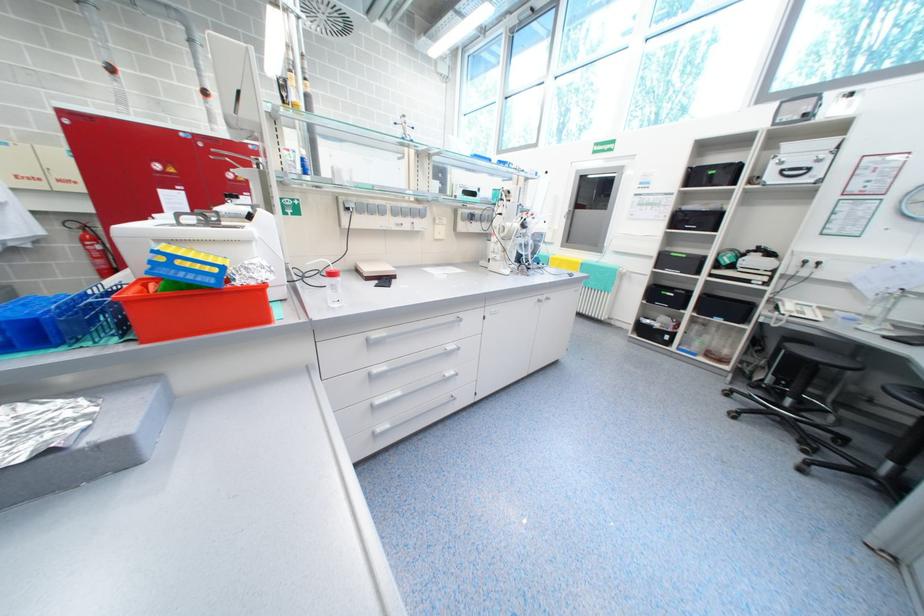
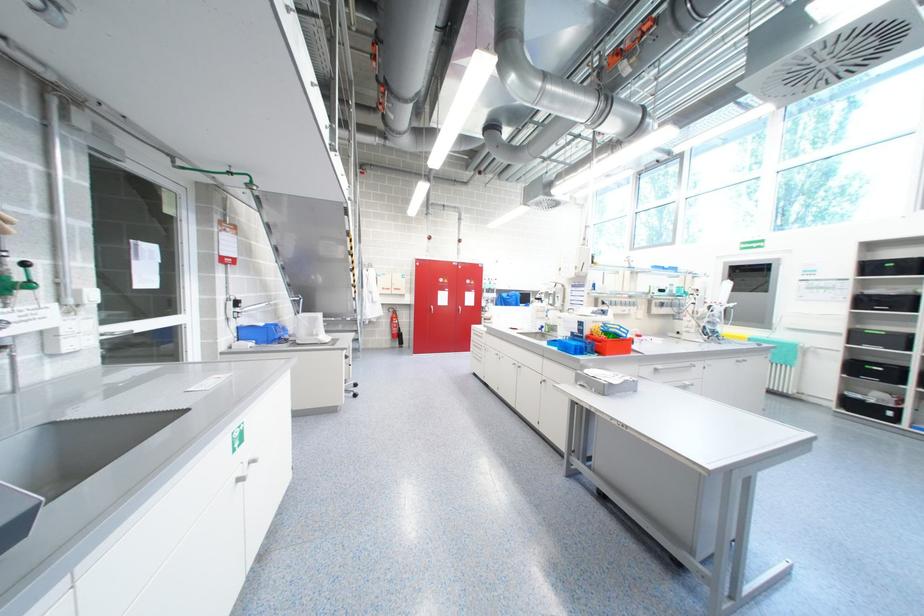
In the scene shown: What movement of the cameraman would produce the second image?

The cameraman walked toward left, backward.